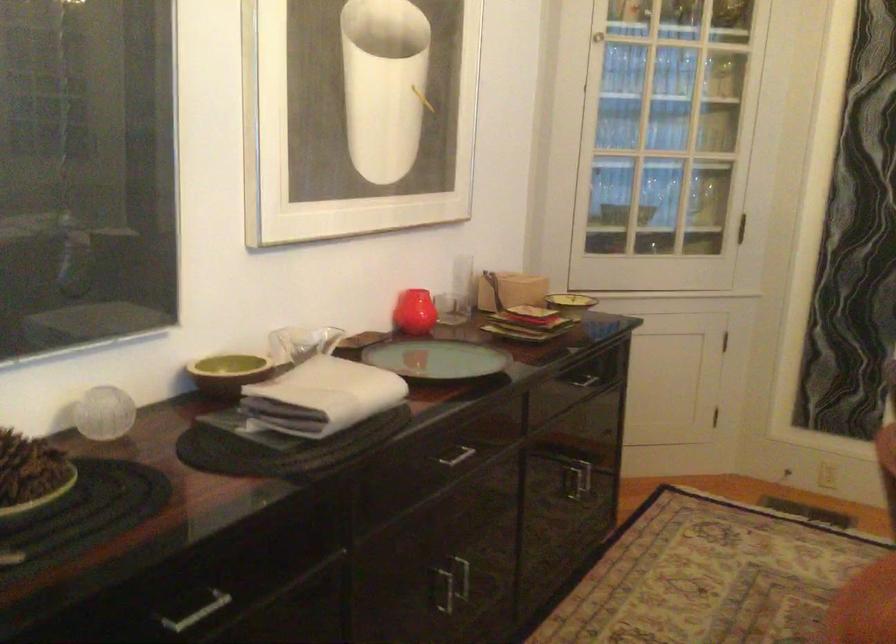
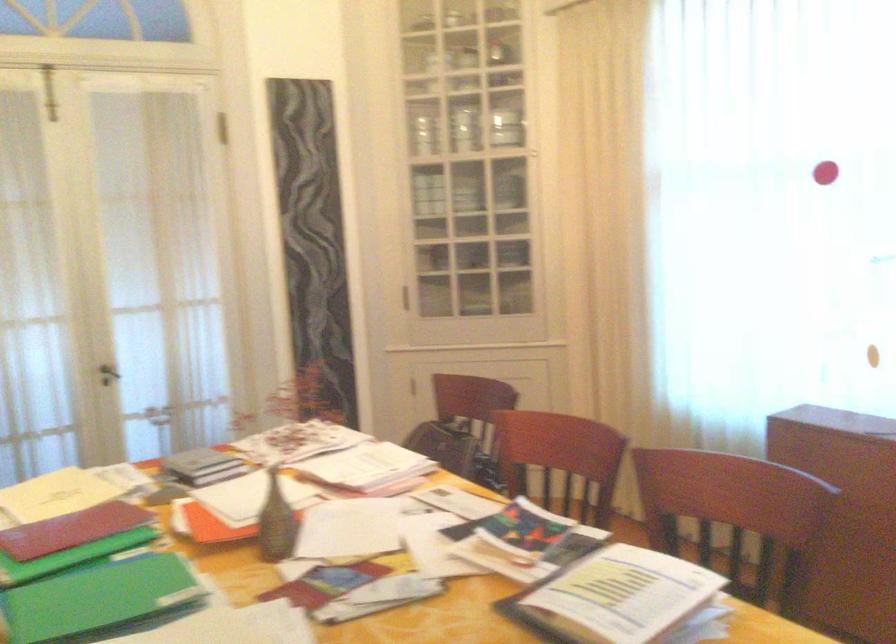
Question: The first image is from the beginning of the video and the second image is from the end. How did the camera likely rotate when shooting the video?

Choices:
 (A) Left
 (B) Right
 (C) Up
 (D) Down

Answer: (B)